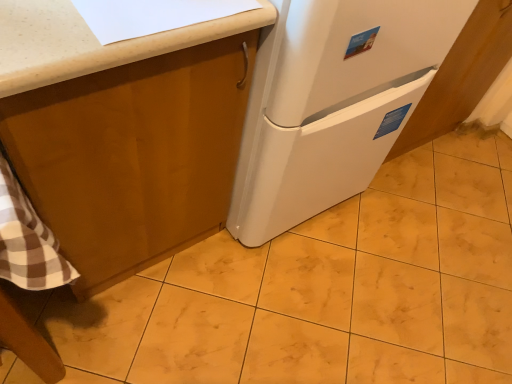
Question: Is matte wood cabinet at upper left, marked as the first cabinetry in a left-to-right arrangement, wider or thinner than white glossy cabinet at lower right, the 1th cabinetry in the right-to-left sequence?

Choices:
 (A) wide
 (B) thin

Answer: (A)

Question: Considering the positions of matte wood cabinet at upper left, which ranks as the 2th cabinetry in right-to-left order, and white glossy cabinet at lower right, arranged as the second cabinetry when viewed from the left, in the image, is matte wood cabinet at upper left, which ranks as the 2th cabinetry in right-to-left order, taller or shorter than white glossy cabinet at lower right, arranged as the second cabinetry when viewed from the left,?

Choices:
 (A) short
 (B) tall

Answer: (B)

Question: Which object is positioned farthest from the matte wood cabinet at upper left, which ranks as the 2th cabinetry in right-to-left order?

Choices:
 (A) white glossy cabinet at lower right, the 1th cabinetry in the right-to-left sequence
 (B) white matte refrigerator at center
 (C) yellow marble tile at center

Answer: (A)

Question: Estimate the real-world distances between objects in this image. Which object is farther from the white matte refrigerator at center?

Choices:
 (A) white glossy cabinet at lower right, the 1th cabinetry in the right-to-left sequence
 (B) matte wood cabinet at upper left, which ranks as the 2th cabinetry in right-to-left order
 (C) yellow marble tile at center

Answer: (C)